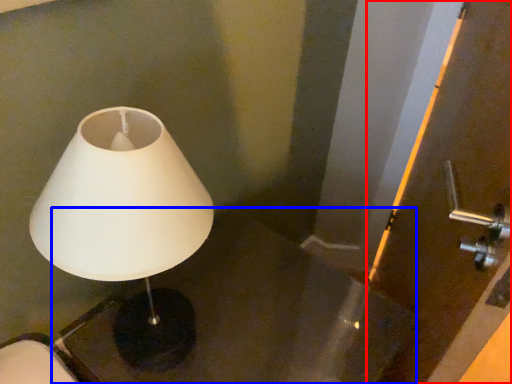
Question: Which point is closer to the camera, screen door (highlighted by a red box) or table (highlighted by a blue box)?

Choices:
 (A) screen door
 (B) table

Answer: (A)